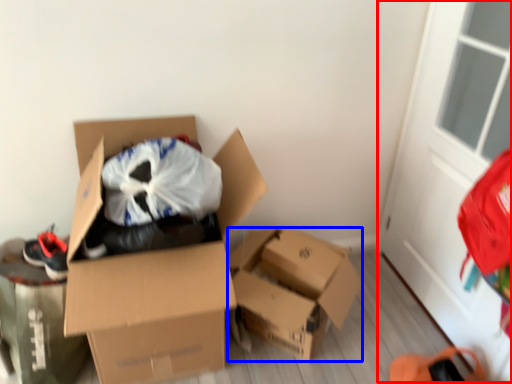
Question: Which point is closer to the camera, screen door (highlighted by a red box) or box (highlighted by a blue box)?

Choices:
 (A) screen door
 (B) box

Answer: (A)